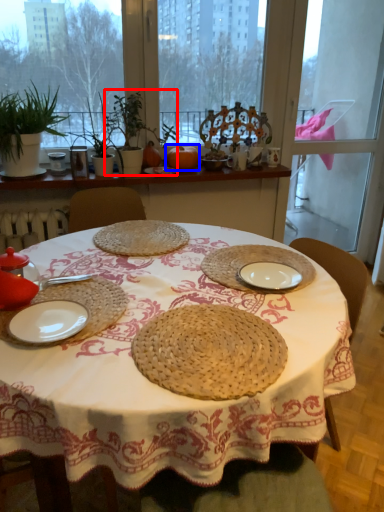
Question: Which object is closer to the camera taking this photo, plant (highlighted by a red box) or fruit (highlighted by a blue box)?

Choices:
 (A) plant
 (B) fruit

Answer: (A)